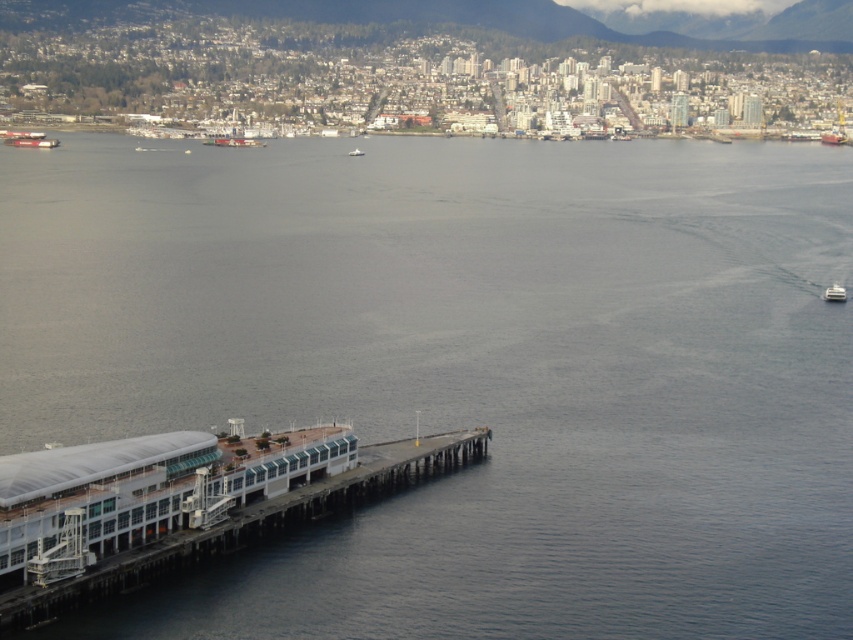
Question: Estimate the real-world distances between objects in this image. Which object is closer to the white plastic boat at center?

Choices:
 (A) metallic gray pier at lower left
 (B) metallic gray ship at left
 (C) white plastic boat at lower right

Answer: (B)

Question: Among these points, which one is farthest from the camera?

Choices:
 (A) (48, 147)
 (B) (354, 148)
 (C) (97, 540)
 (D) (844, 291)

Answer: (A)

Question: Can you confirm if metallic gray ship at left is positioned to the left of white plastic boat at lower right?

Choices:
 (A) yes
 (B) no

Answer: (A)

Question: Is metallic gray pier at lower left thinner than white plastic boat at lower right?

Choices:
 (A) yes
 (B) no

Answer: (B)

Question: Does metallic gray pier at lower left have a larger size compared to metallic gray ship at left?

Choices:
 (A) no
 (B) yes

Answer: (B)

Question: Which object appears farthest from the camera in this image?

Choices:
 (A) white plastic boat at center
 (B) white plastic boat at lower right
 (C) metallic gray pier at lower left
 (D) metallic gray ship at left

Answer: (D)